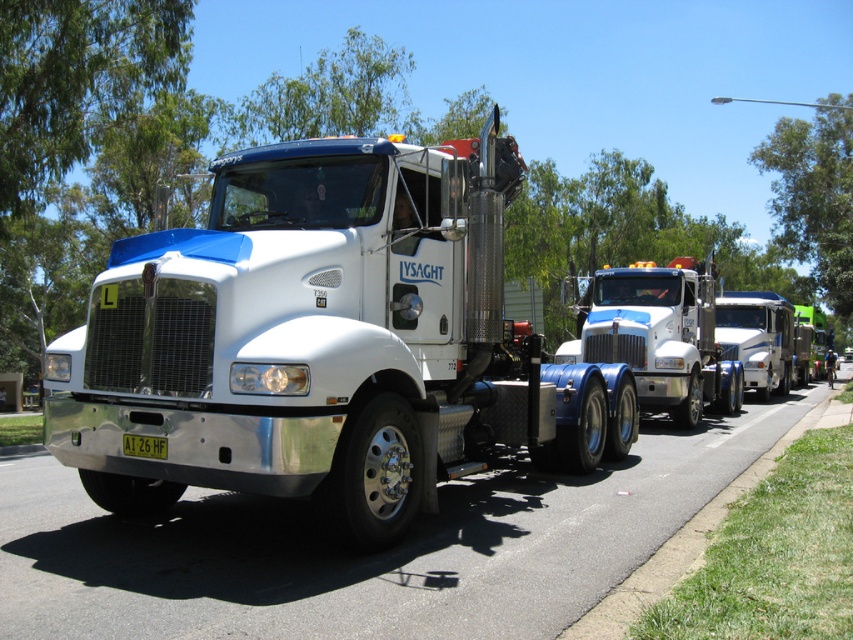
Is point (711, 404) closer to camera compared to point (670, 548)?

That is False.

Which is more to the right, white glossy trailer truck at center or grassy sidewalk at lower right?

Positioned to the right is grassy sidewalk at lower right.

Locate an element on the screen. The image size is (853, 640). white glossy trailer truck at center is located at coordinates (659, 336).

Which of these two, white metallic truck at center or grassy sidewalk at lower right, stands shorter?

grassy sidewalk at lower right

Who is positioned more to the right, white metallic truck at center or grassy sidewalk at lower right?

Positioned to the right is grassy sidewalk at lower right.

Does point (398, 184) come behind point (643, 586)?

Yes, it is behind point (643, 586).

The image size is (853, 640). In order to click on white metallic truck at center in this screenshot , I will do `click(323, 342)`.

Between point (679, 323) and point (753, 342), which one is positioned in front?

Point (679, 323)

Image resolution: width=853 pixels, height=640 pixels. Describe the element at coordinates (659, 336) in the screenshot. I see `white glossy trailer truck at center` at that location.

I want to click on white glossy trailer truck at center, so click(659, 336).